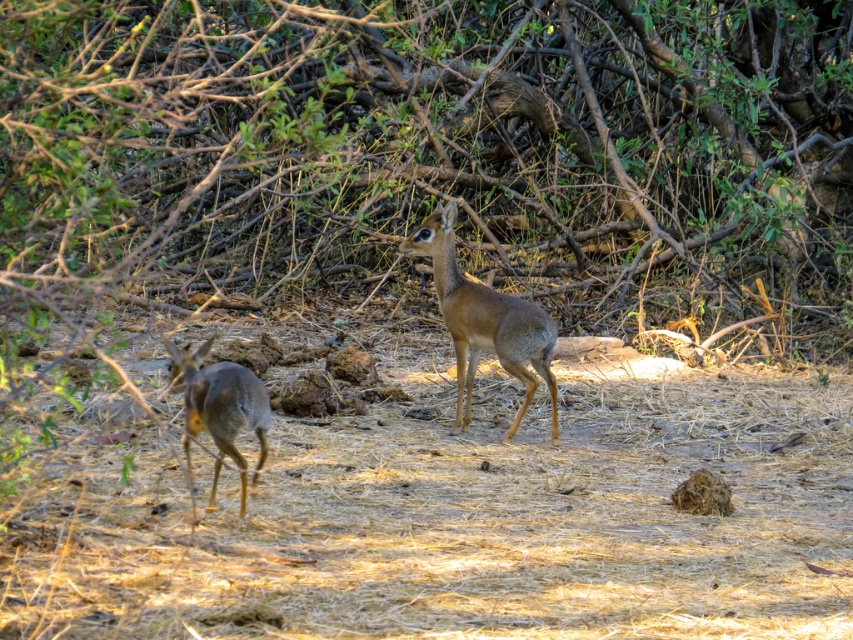
You are a photographer trying to capture both the brown furry deer at center and the brown fur deer at left in a single frame. Based on their positions, which deer is closer to the camera?

The brown furry deer at center is closer to the camera because the brown fur deer at left is behind it.

Consider the image. You are standing in the natural outdoor setting depicted in the image. You see a point marked at coordinates (485, 321). What animal does this point correspond to?

The point at coordinates (485, 321) corresponds to the brown furry deer at center.